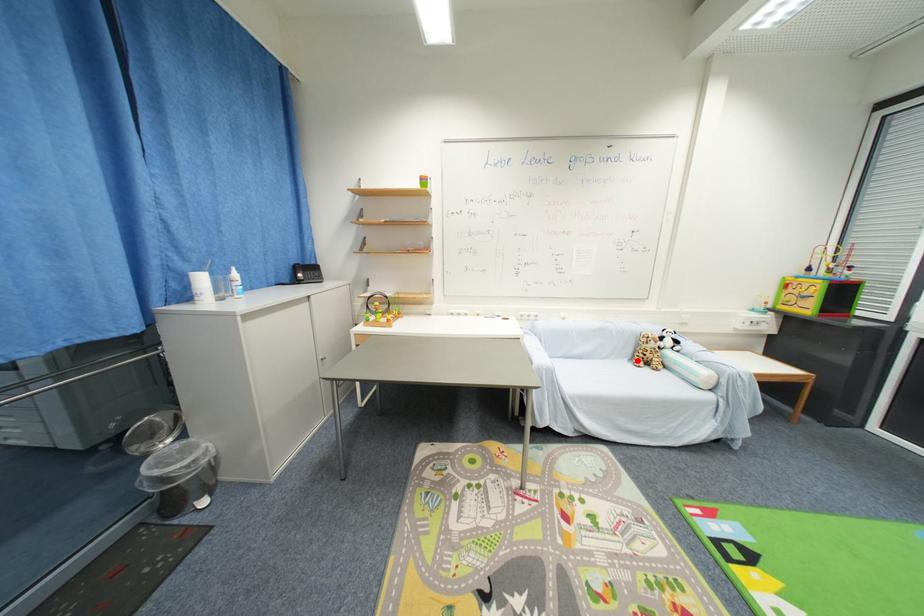
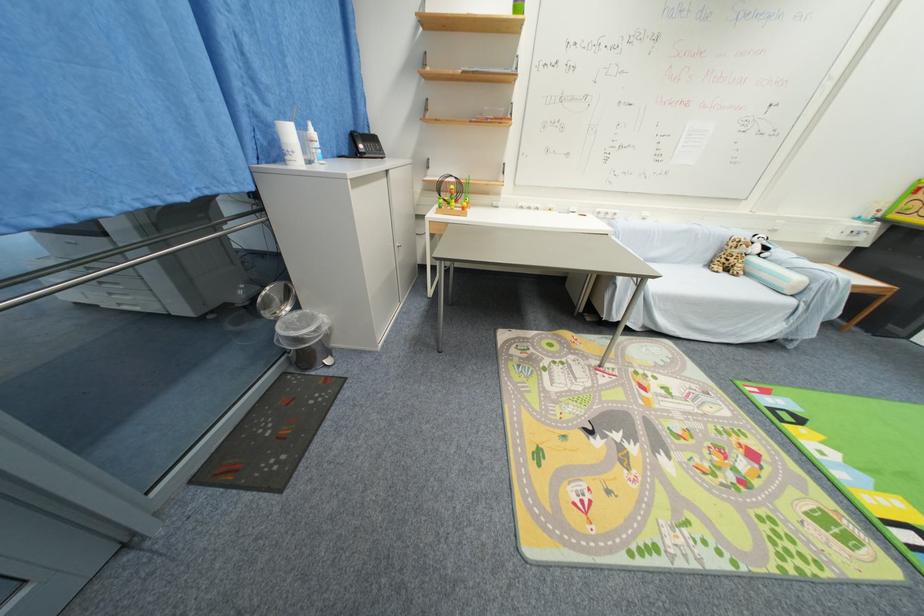
Locate, in the second image, the point that corresponds to the highlighted location in the first image.

(714, 265)